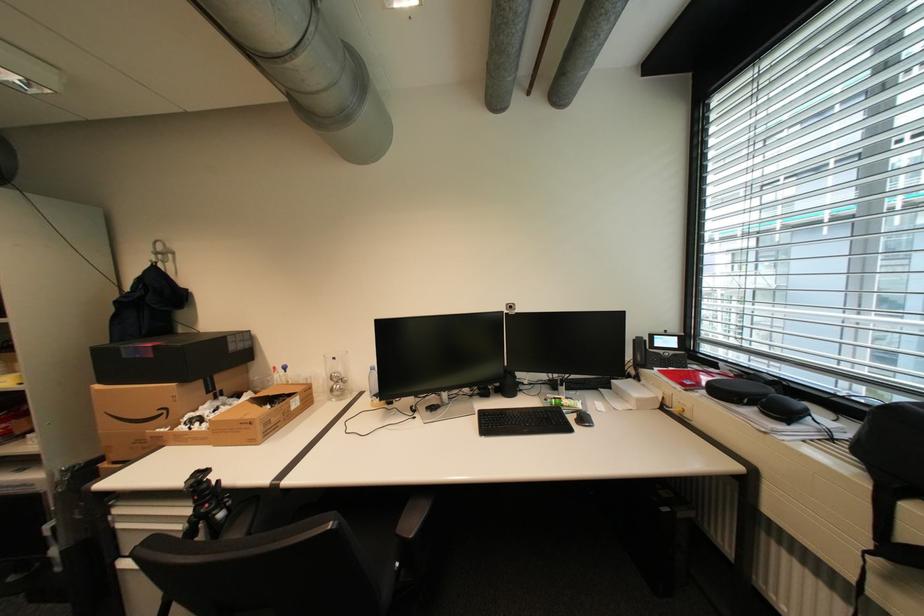
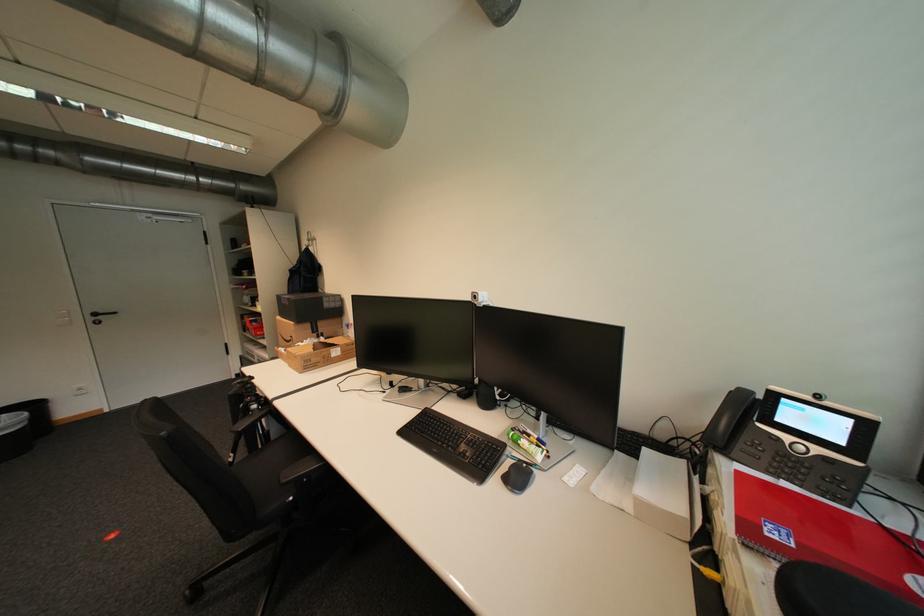
In the second image, find the point that corresponds to pixel 224 513 in the first image.

(261, 403)